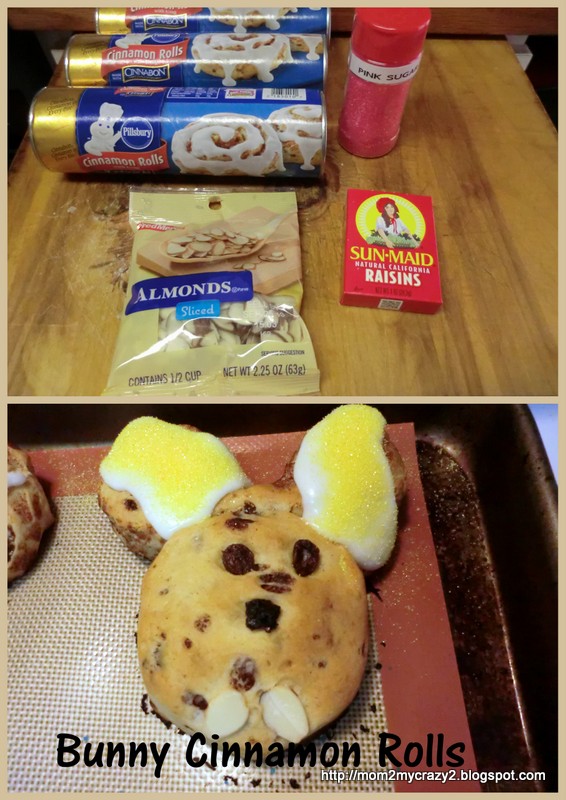
Identify the location of rubber mat. This screenshot has width=566, height=800. (52, 682).